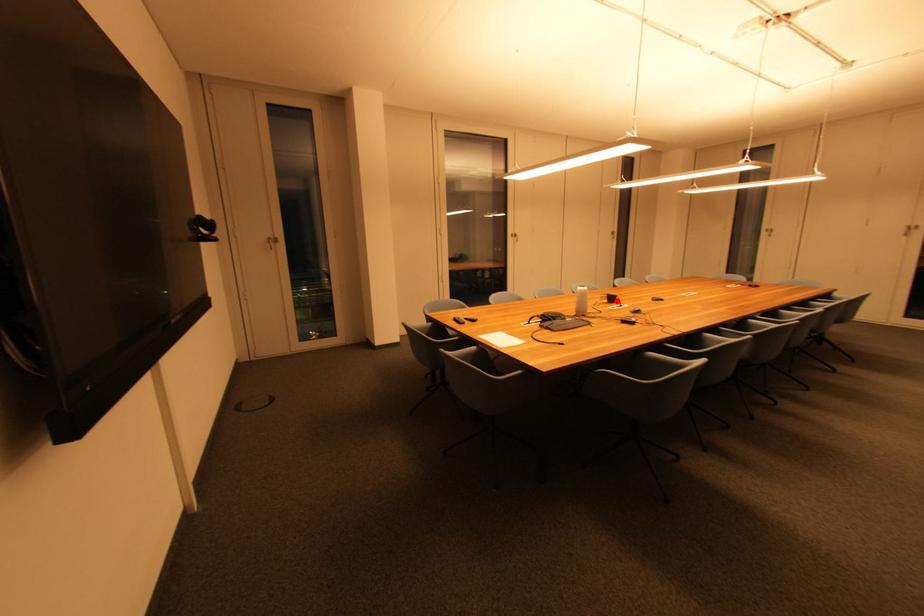
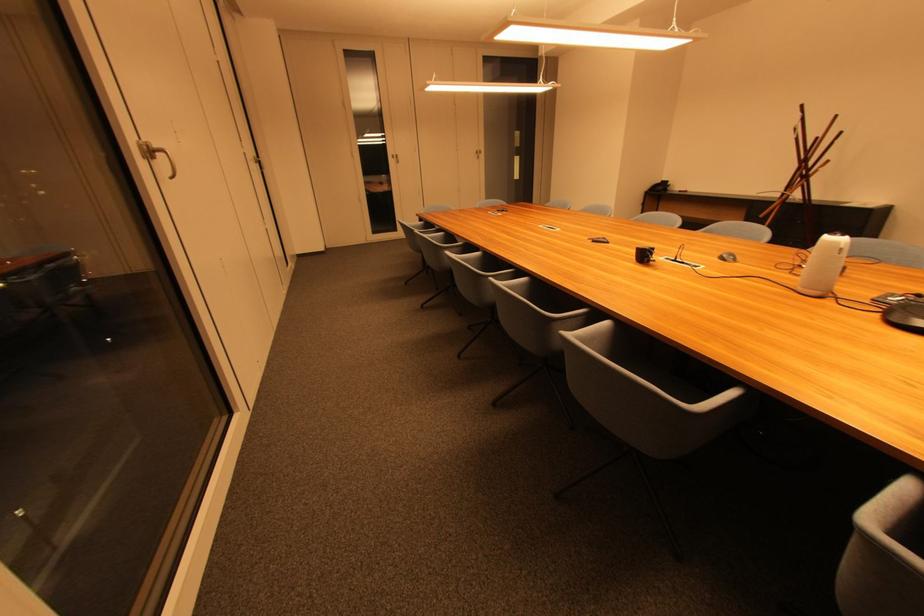
Locate, in the second image, the point that corresponds to the highlighted location in the first image.

(649, 257)